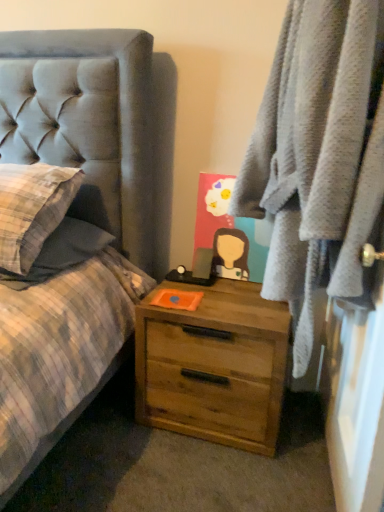
Question: Is soft gray robe at right completely or partially inside wooden chest of drawers at lower right?

Choices:
 (A) yes
 (B) no

Answer: (B)

Question: Considering the relative sizes of wooden chest of drawers at lower right and soft gray robe at right in the image provided, is wooden chest of drawers at lower right bigger than soft gray robe at right?

Choices:
 (A) yes
 (B) no

Answer: (B)

Question: Can you confirm if wooden chest of drawers at lower right is positioned to the left of soft gray robe at right?

Choices:
 (A) no
 (B) yes

Answer: (B)

Question: Is wooden chest of drawers at lower right turned away from soft gray robe at right?

Choices:
 (A) yes
 (B) no

Answer: (B)

Question: Is wooden chest of drawers at lower right completely or partially outside of soft gray robe at right?

Choices:
 (A) yes
 (B) no

Answer: (A)

Question: Are wooden chest of drawers at lower right and soft gray robe at right located far from each other?

Choices:
 (A) no
 (B) yes

Answer: (A)

Question: From a real-world perspective, is soft gray robe at right on wooden chest of drawers at lower right?

Choices:
 (A) yes
 (B) no

Answer: (A)

Question: Does soft gray robe at right have a greater height compared to wooden chest of drawers at lower right?

Choices:
 (A) yes
 (B) no

Answer: (A)

Question: Is soft gray robe at right next to wooden chest of drawers at lower right and touching it?

Choices:
 (A) yes
 (B) no

Answer: (B)

Question: Is soft gray robe at right not within wooden chest of drawers at lower right?

Choices:
 (A) yes
 (B) no

Answer: (A)

Question: Is the depth of soft gray robe at right greater than that of wooden chest of drawers at lower right?

Choices:
 (A) no
 (B) yes

Answer: (A)

Question: Is soft gray robe at right wider than wooden chest of drawers at lower right?

Choices:
 (A) yes
 (B) no

Answer: (B)

Question: In terms of width, does wooden chest of drawers at lower right look wider or thinner when compared to soft gray robe at right?

Choices:
 (A) thin
 (B) wide

Answer: (B)